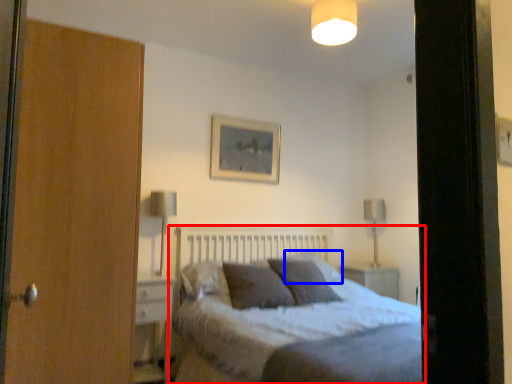
Question: Which object appears closest to the camera in this image, bed (highlighted by a red box) or pillow (highlighted by a blue box)?

Choices:
 (A) bed
 (B) pillow

Answer: (A)